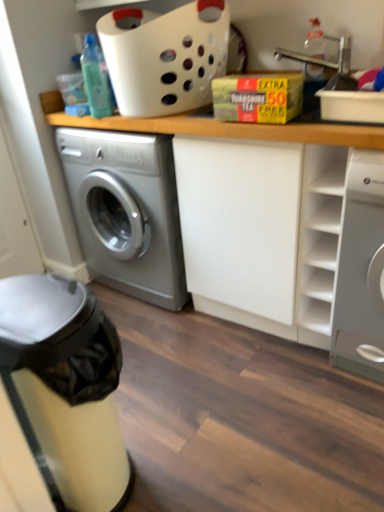
Locate an element on the screen. empty space that is ontop of matte silver dishwasher at lower left (from a real-world perspective) is located at coordinates (42, 301).